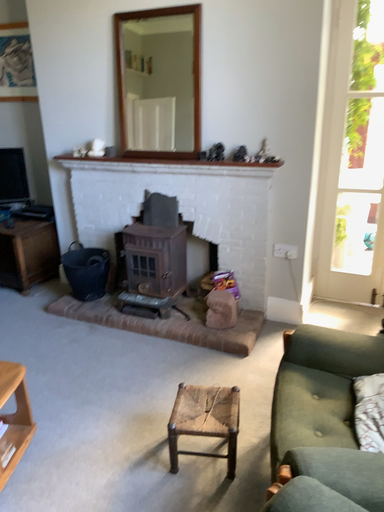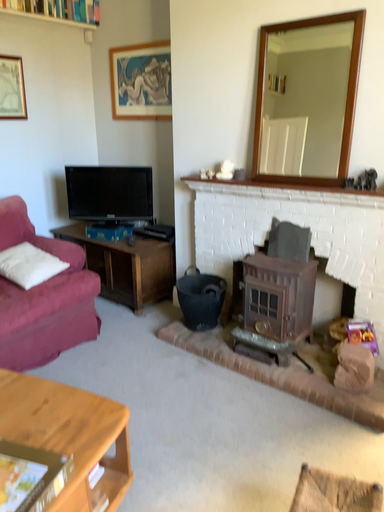
Question: Which way did the camera rotate in the video?

Choices:
 (A) rotated left
 (B) rotated right

Answer: (A)